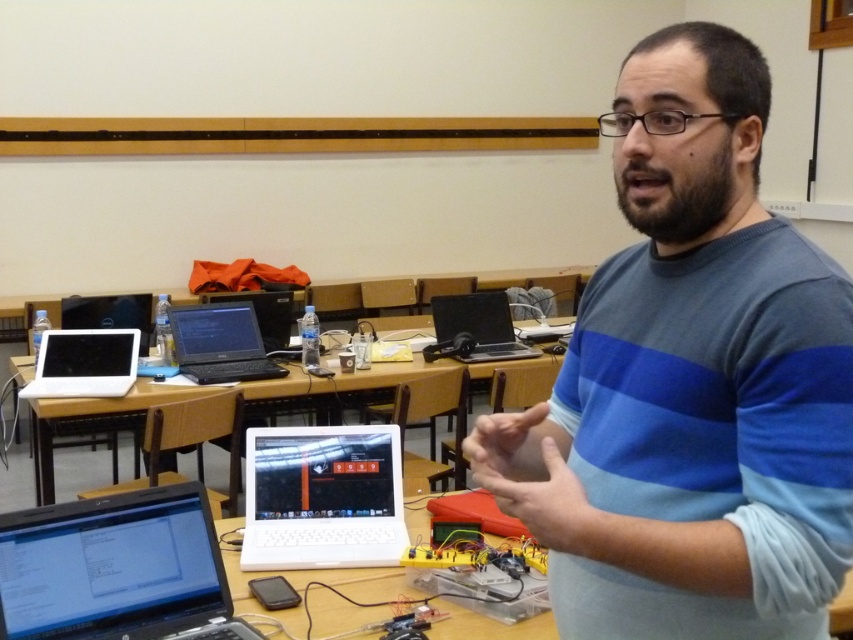
Between silver metallic laptop at lower left and white matte laptop at left, which one is positioned higher?

white matte laptop at left

Based on the photo, is silver metallic laptop at lower left below white matte laptop at left?

Yes.

The height and width of the screenshot is (640, 853). Identify the location of silver metallic laptop at lower left. (115, 570).

Locate an element on the screen. Image resolution: width=853 pixels, height=640 pixels. silver metallic laptop at lower left is located at coordinates (115, 570).

Which is above, blue striped sweater at center or silver metallic laptop at lower left?

blue striped sweater at center

Between point (704, 250) and point (158, 637), which one is positioned in front?

Point (704, 250) is in front.

You are a GUI agent. You are given a task and a screenshot of the screen. Output one action in this format:
    pyautogui.click(x=<x>, y=<y>)
    Task: Click on the blue striped sweater at center
    The height and width of the screenshot is (640, 853).
    Given the screenshot: What is the action you would take?
    pyautogui.click(x=691, y=381)

Is white plastic laptop at center below white matte laptop at left?

Yes.

Who is taller, white plastic laptop at center or white matte laptop at left?

white plastic laptop at center

Which is behind, point (387, 502) or point (108, 358)?

The point (108, 358) is behind.

At what (x,y) coordinates should I click in order to perform the action: click on white plastic laptop at center. Please return your answer as a coordinate pair (x, y). Looking at the image, I should click on (322, 497).